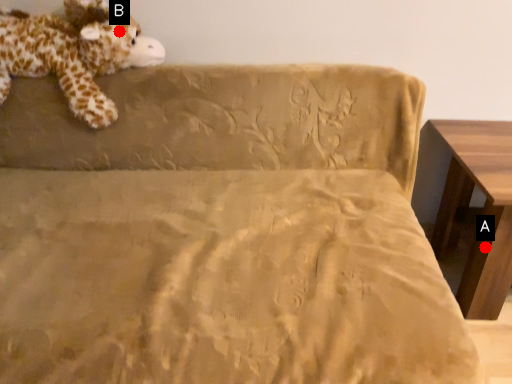
Question: Two points are circled on the image, labeled by A and B beside each circle. Which point is closer to the camera?

Choices:
 (A) A is closer
 (B) B is closer

Answer: (A)